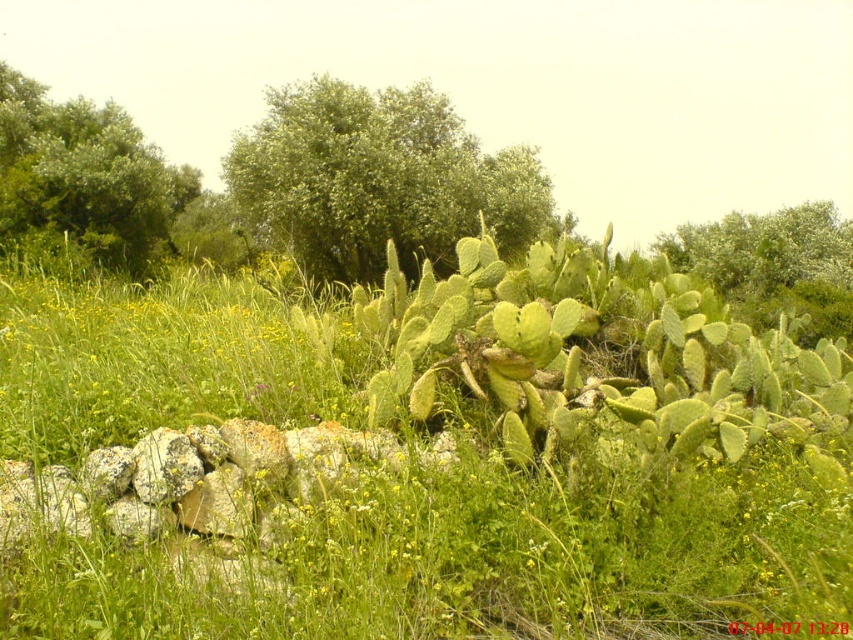
You are standing in the natural landscape described and want to find the green leafy tree at upper left. Which direction should you look relative to the green leafy tree at center?

The green leafy tree at center is located above the green leafy tree at upper left, so to find the green leafy tree at upper left, you should look downward from the green leafy tree at center.

You are a bird looking for a nesting spot. You see the green leafy tree at center and the green leafy tree at upper left. Which tree has a larger canopy to provide more shelter?

Result: The green leafy tree at center might be wider than green leafy tree at upper left, so it has a larger canopy to provide more shelter.

You are a hiker who wants to take a photo of the green leafy tree at upper center. To avoid having the green leafy tree at upper left block the view, which direction should you move relative to your current position?

The green leafy tree at upper left is taller than the green leafy tree at upper center. To avoid the taller tree blocking the view, move to the right so that the shorter tree is positioned between you and the taller tree.